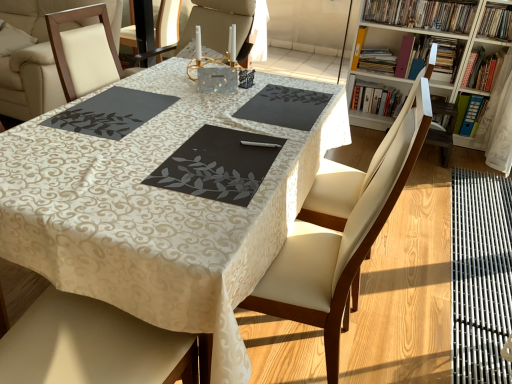
Question: Should I look upward or downward to see wooden bookcase at upper right?

Choices:
 (A) up
 (B) down

Answer: (A)

Question: Which direction should I rotate to look at dark gray matte placemat at center, the third place mat positioned from the right?

Choices:
 (A) left
 (B) right

Answer: (A)

Question: From the image's perspective, would you say black matte placemat at center, positioned as the third place mat in left-to-right order, is shown under blue plastic folder at upper right, positioned as the seventh book in left-to-right order?

Choices:
 (A) no
 (B) yes

Answer: (B)

Question: From the image's perspective, is black matte placemat at center, the 1th place mat when ordered from right to left, located above blue plastic folder at upper right, positioned as the seventh book in left-to-right order?

Choices:
 (A) yes
 (B) no

Answer: (B)

Question: From a real-world perspective, is black matte placemat at center, the 1th place mat when ordered from right to left, positioned over blue plastic folder at upper right, positioned as the seventh book in left-to-right order, based on gravity?

Choices:
 (A) yes
 (B) no

Answer: (A)

Question: Considering the relative sizes of black matte placemat at center, the 1th place mat when ordered from right to left, and blue plastic folder at upper right, marked as the 3th book in a right-to-left arrangement, in the image provided, is black matte placemat at center, the 1th place mat when ordered from right to left, taller than blue plastic folder at upper right, marked as the 3th book in a right-to-left arrangement,?

Choices:
 (A) no
 (B) yes

Answer: (A)

Question: Considering the relative sizes of black matte placemat at center, the 1th place mat when ordered from right to left, and blue plastic folder at upper right, positioned as the seventh book in left-to-right order, in the image provided, is black matte placemat at center, the 1th place mat when ordered from right to left, shorter than blue plastic folder at upper right, positioned as the seventh book in left-to-right order,?

Choices:
 (A) yes
 (B) no

Answer: (A)

Question: Is black matte placemat at center, positioned as the third place mat in left-to-right order, at the left side of blue plastic folder at upper right, positioned as the seventh book in left-to-right order?

Choices:
 (A) no
 (B) yes

Answer: (B)

Question: Does hardcover books at upper right, marked as the third book in a left-to-right arrangement, appear on the left side of dark gray matte placemat at center, which appears as the 1th place mat when viewed from the left?

Choices:
 (A) yes
 (B) no

Answer: (B)

Question: Is hardcover books at upper right, marked as the third book in a left-to-right arrangement, behind dark gray matte placemat at center, the third place mat positioned from the right?

Choices:
 (A) no
 (B) yes

Answer: (B)

Question: Is hardcover books at upper right, marked as the third book in a left-to-right arrangement, facing away from dark gray matte placemat at center, which appears as the 1th place mat when viewed from the left?

Choices:
 (A) yes
 (B) no

Answer: (B)

Question: Is hardcover books at upper right, the 7th book from the right, shorter than dark gray matte placemat at center, which appears as the 1th place mat when viewed from the left?

Choices:
 (A) yes
 (B) no

Answer: (B)

Question: Does hardcover books at upper right, the 7th book from the right, have a larger size compared to dark gray matte placemat at center, the third place mat positioned from the right?

Choices:
 (A) yes
 (B) no

Answer: (A)

Question: Considering the relative sizes of hardcover books at upper right, the 7th book from the right, and dark gray matte placemat at center, the third place mat positioned from the right, in the image provided, is hardcover books at upper right, the 7th book from the right, thinner than dark gray matte placemat at center, the third place mat positioned from the right,?

Choices:
 (A) no
 (B) yes

Answer: (B)

Question: From a real-world perspective, is leather seat at center beneath wooden bookcase at upper right?

Choices:
 (A) no
 (B) yes

Answer: (B)